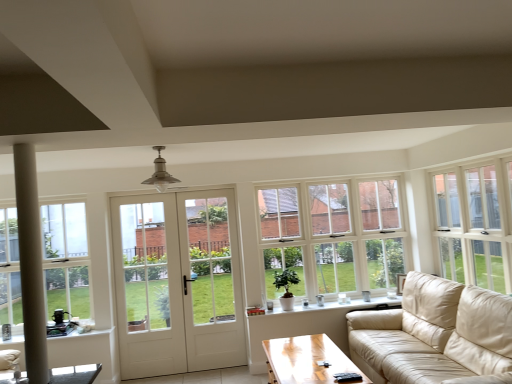
Question: From the image's perspective, is white wooden door at center below white glass door at center?

Choices:
 (A) no
 (B) yes

Answer: (B)

Question: Can you confirm if white wooden door at center is thinner than white glass door at center?

Choices:
 (A) yes
 (B) no

Answer: (A)

Question: Does white wooden door at center have a smaller size compared to white glass door at center?

Choices:
 (A) no
 (B) yes

Answer: (A)

Question: Is there a large distance between white wooden door at center and white glass door at center?

Choices:
 (A) no
 (B) yes

Answer: (A)

Question: Is white wooden door at center positioned beyond the bounds of white glass door at center?

Choices:
 (A) no
 (B) yes

Answer: (A)

Question: From a real-world perspective, is white glass window at center, the third window when ordered from front to back, positioned above or below white glass window at upper right, which ranks as the third window in left-to-right order?

Choices:
 (A) above
 (B) below

Answer: (B)

Question: Is white glass window at center, the third window when ordered from front to back, taller or shorter than white glass window at upper right, which ranks as the third window in left-to-right order?

Choices:
 (A) tall
 (B) short

Answer: (A)

Question: Choose the correct answer: Is white glass window at center, placed as the second window when sorted from left to right, inside white glass window at upper right, which ranks as the third window in left-to-right order, or outside it?

Choices:
 (A) outside
 (B) inside

Answer: (A)

Question: In terms of size, does white glass window at center, the third window when ordered from front to back, appear bigger or smaller than white glass window at upper right, the first window when ordered from front to back?

Choices:
 (A) small
 (B) big

Answer: (A)

Question: From the image's perspective, relative to white ceramic windowsill at lower center, is white glass window at upper right, marked as the 3th window in a back-to-front arrangement, above or below?

Choices:
 (A) below
 (B) above

Answer: (B)

Question: Is white glass window at upper right, the first window when ordered from front to back, wider or thinner than white ceramic windowsill at lower center?

Choices:
 (A) thin
 (B) wide

Answer: (A)

Question: Is point (507, 211) positioned closer to the camera than point (313, 304)?

Choices:
 (A) farther
 (B) closer

Answer: (B)

Question: From their relative heights in the image, would you say white glass window at upper right, marked as the 3th window in a back-to-front arrangement, is taller or shorter than white ceramic windowsill at lower center?

Choices:
 (A) tall
 (B) short

Answer: (A)

Question: Is clear glass window at left, marked as the first window in a left-to-right arrangement, bigger or smaller than white glass window at upper right, which ranks as the third window in left-to-right order?

Choices:
 (A) big
 (B) small

Answer: (B)

Question: From the image's perspective, is clear glass window at left, which ranks as the 2th window in back-to-front order, positioned above or below white glass window at upper right, marked as the 3th window in a back-to-front arrangement?

Choices:
 (A) above
 (B) below

Answer: (B)